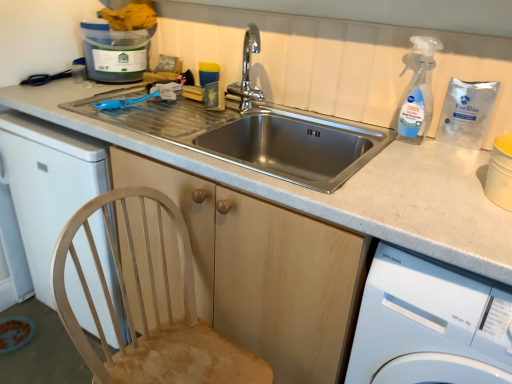
The height and width of the screenshot is (384, 512). I want to click on space that is in front of blue plastic container at upper left, so click(97, 91).